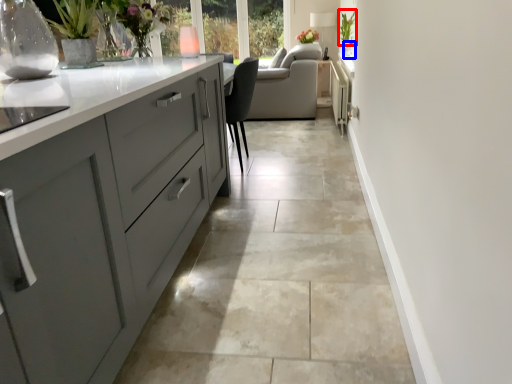
Question: Which object is further to the camera taking this photo, plant (highlighted by a red box) or glass vase (highlighted by a blue box)?

Choices:
 (A) plant
 (B) glass vase

Answer: (A)